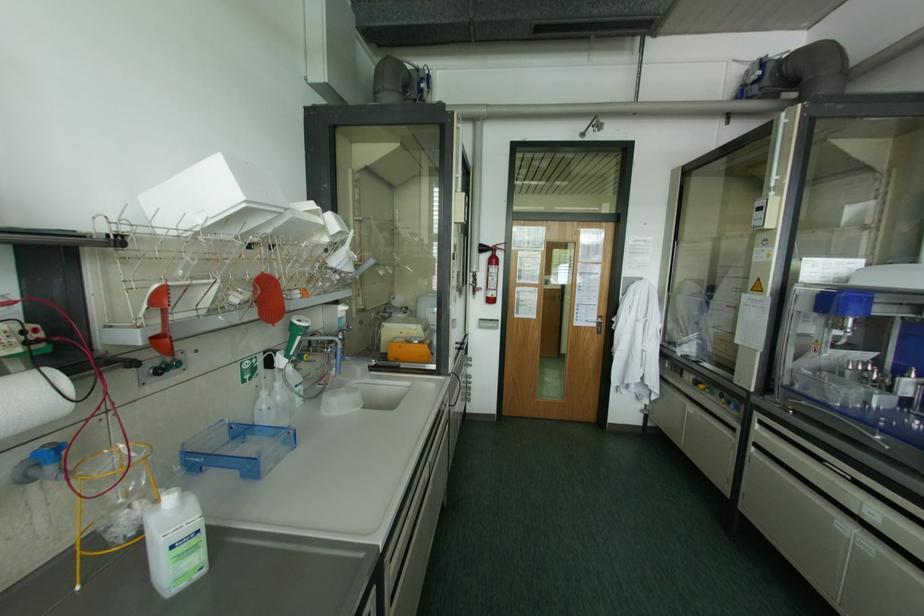
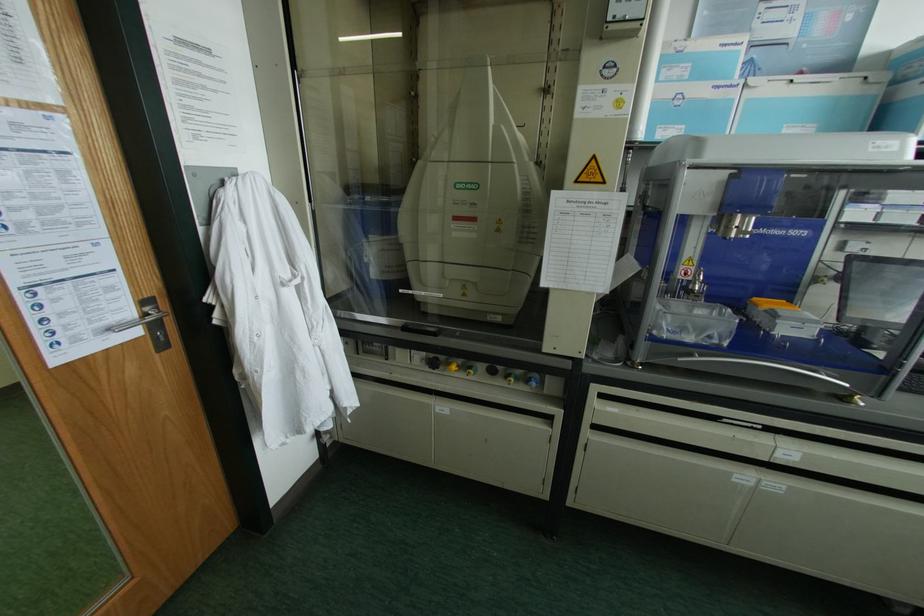
Where in the second image is the point corresponding to [696,383] from the first image?

(432, 363)